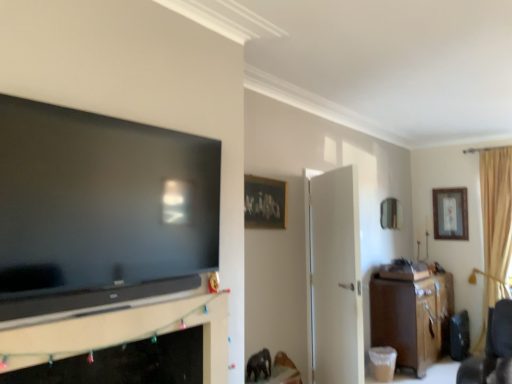
Question: Considering the relative positions of beige fabric curtain at right and wooden framed picture at upper right, which ranks as the third picture frame in front-to-back order, in the image provided, is beige fabric curtain at right to the left of wooden framed picture at upper right, which ranks as the third picture frame in front-to-back order, from the viewer's perspective?

Choices:
 (A) yes
 (B) no

Answer: (B)

Question: Can you confirm if beige fabric curtain at right is thinner than wooden framed picture at upper right, which ranks as the third picture frame in front-to-back order?

Choices:
 (A) yes
 (B) no

Answer: (B)

Question: Can you confirm if beige fabric curtain at right is bigger than wooden framed picture at upper right, which ranks as the third picture frame in front-to-back order?

Choices:
 (A) no
 (B) yes

Answer: (B)

Question: Considering the relative sizes of beige fabric curtain at right and wooden framed picture at upper right, which ranks as the third picture frame in front-to-back order, in the image provided, is beige fabric curtain at right wider than wooden framed picture at upper right, which ranks as the third picture frame in front-to-back order,?

Choices:
 (A) no
 (B) yes

Answer: (B)

Question: Is beige fabric curtain at right aimed at wooden framed picture at upper right, the first picture frame from the right?

Choices:
 (A) yes
 (B) no

Answer: (B)

Question: From a real-world perspective, is white matte door at center physically located above or below brown wood cabinet at right?

Choices:
 (A) below
 (B) above

Answer: (B)

Question: Visually, is white matte door at center positioned to the left or to the right of brown wood cabinet at right?

Choices:
 (A) left
 (B) right

Answer: (A)

Question: Is white matte door at center in front of or behind brown wood cabinet at right in the image?

Choices:
 (A) front
 (B) behind

Answer: (A)

Question: Based on their sizes in the image, would you say white matte door at center is bigger or smaller than brown wood cabinet at right?

Choices:
 (A) big
 (B) small

Answer: (B)

Question: From the image's perspective, is metallic mirror at upper right, which is the second picture frame in left-to-right order, located above or below matte black tv at left?

Choices:
 (A) below
 (B) above

Answer: (A)

Question: Considering the positions of point (386, 208) and point (84, 157), is point (386, 208) closer or farther from the camera than point (84, 157)?

Choices:
 (A) closer
 (B) farther

Answer: (B)

Question: Considering the positions of metallic mirror at upper right, which is the 2th picture frame from back to front, and matte black tv at left in the image, is metallic mirror at upper right, which is the 2th picture frame from back to front, wider or thinner than matte black tv at left?

Choices:
 (A) thin
 (B) wide

Answer: (A)

Question: Is metallic mirror at upper right, the second picture frame when ordered from front to back, inside or outside of matte black tv at left?

Choices:
 (A) inside
 (B) outside

Answer: (B)

Question: From their relative heights in the image, would you say metallic mirror at upper right, which is the second picture frame in left-to-right order, is taller or shorter than brown wood cabinet at right?

Choices:
 (A) short
 (B) tall

Answer: (A)

Question: Looking at their shapes, would you say metallic mirror at upper right, which is the second picture frame in left-to-right order, is wider or thinner than brown wood cabinet at right?

Choices:
 (A) thin
 (B) wide

Answer: (A)